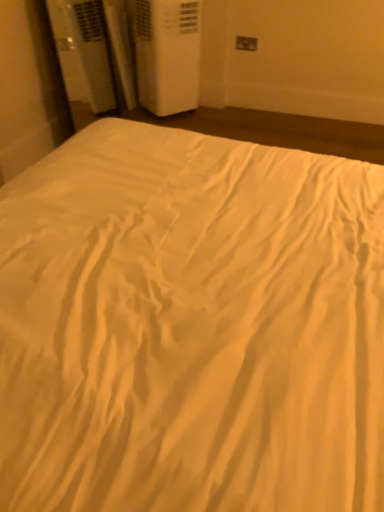
Question: From a real-world perspective, is matte white electric outlet at upper right above or below white plastic air conditioner at upper left?

Choices:
 (A) above
 (B) below

Answer: (A)

Question: From the image's perspective, is matte white electric outlet at upper right positioned above or below white plastic air conditioner at upper left?

Choices:
 (A) above
 (B) below

Answer: (A)

Question: Is matte white electric outlet at upper right in front of or behind white plastic air conditioner at upper left in the image?

Choices:
 (A) behind
 (B) front

Answer: (A)

Question: Is white plastic air conditioner at upper left inside or outside of matte white electric outlet at upper right?

Choices:
 (A) outside
 (B) inside

Answer: (A)

Question: Is white plastic air conditioner at upper left to the left or to the right of matte white electric outlet at upper right in the image?

Choices:
 (A) left
 (B) right

Answer: (A)

Question: From a real-world perspective, is white plastic air conditioner at upper left above or below matte white electric outlet at upper right?

Choices:
 (A) above
 (B) below

Answer: (B)

Question: In terms of height, does white plastic air conditioner at upper left look taller or shorter compared to matte white electric outlet at upper right?

Choices:
 (A) tall
 (B) short

Answer: (A)